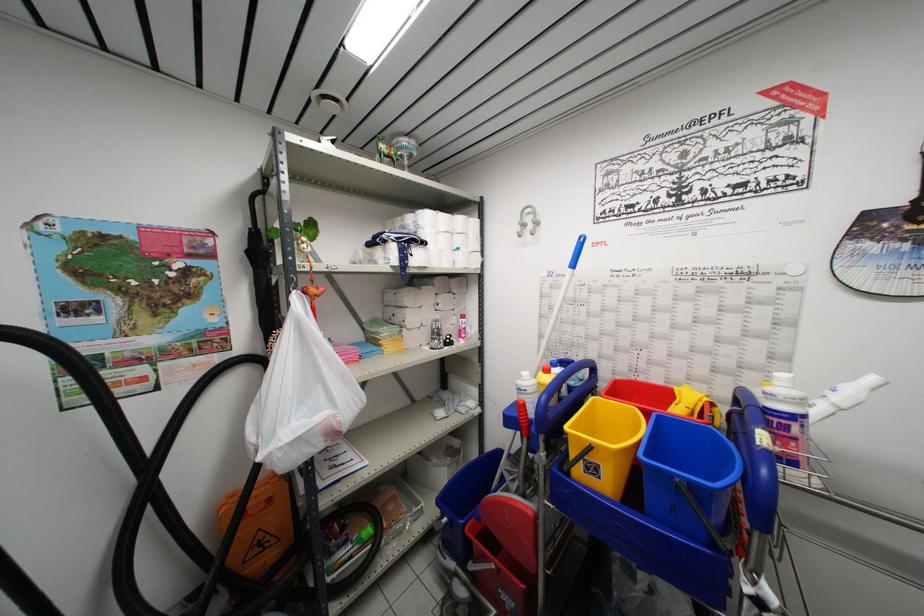
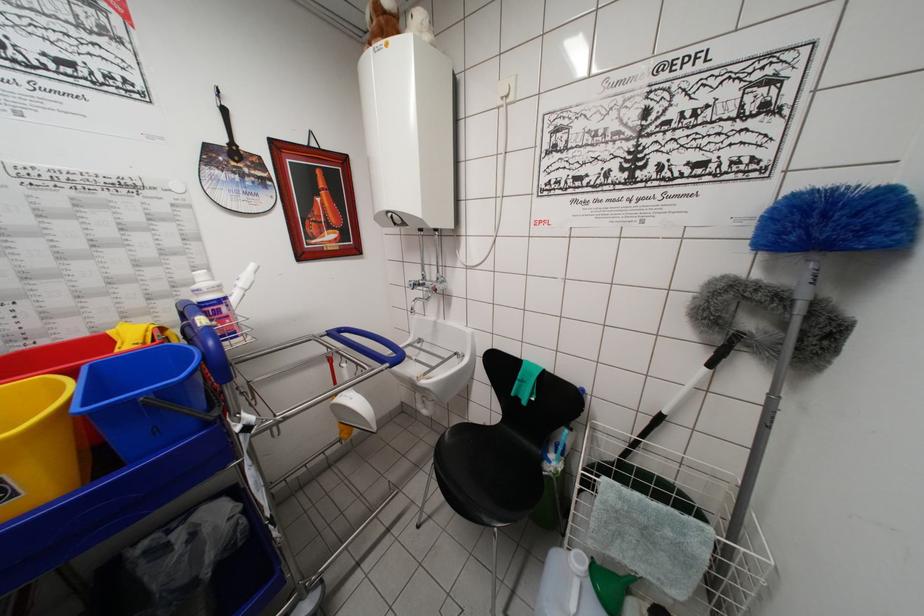
In the second image, find the point that corresponds to point (761, 448) in the first image.

(202, 330)